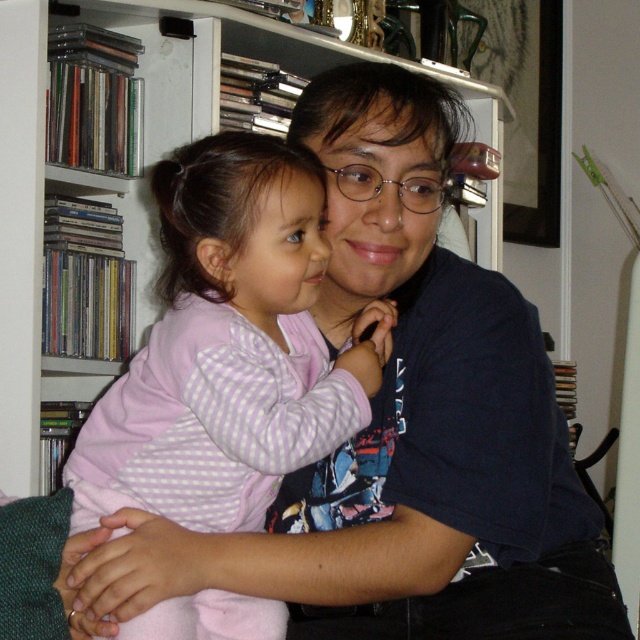
Which is more to the right, pink checkered pajamas at center or white plastic bookshelf at upper center?

white plastic bookshelf at upper center is more to the right.

Based on the photo, who is taller, pink checkered pajamas at center or white plastic bookshelf at upper center?

white plastic bookshelf at upper center

This screenshot has width=640, height=640. What do you see at coordinates (225, 348) in the screenshot?
I see `pink checkered pajamas at center` at bounding box center [225, 348].

Find the location of `pink checkered pajamas at center`. pink checkered pajamas at center is located at coordinates (225, 348).